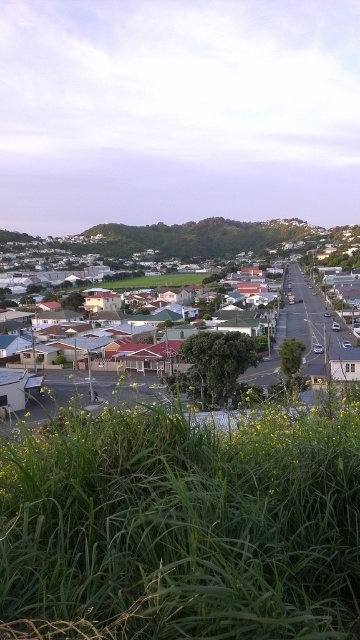
You are standing in the suburban area shown in the image. There are two points marked in the scene. The first is at coordinate point (280, 250) and the second at point (106, 314). Which point is closer to you?

Point (280, 250) is further to the viewer than point (106, 314), so the second point is closer to you.

You are standing at the center of the image and want to walk towards the green grass at lower left. Which direction should you face?

You should face the lower left direction to walk towards the green grass at lower left since its 2D location is at point [185,524].